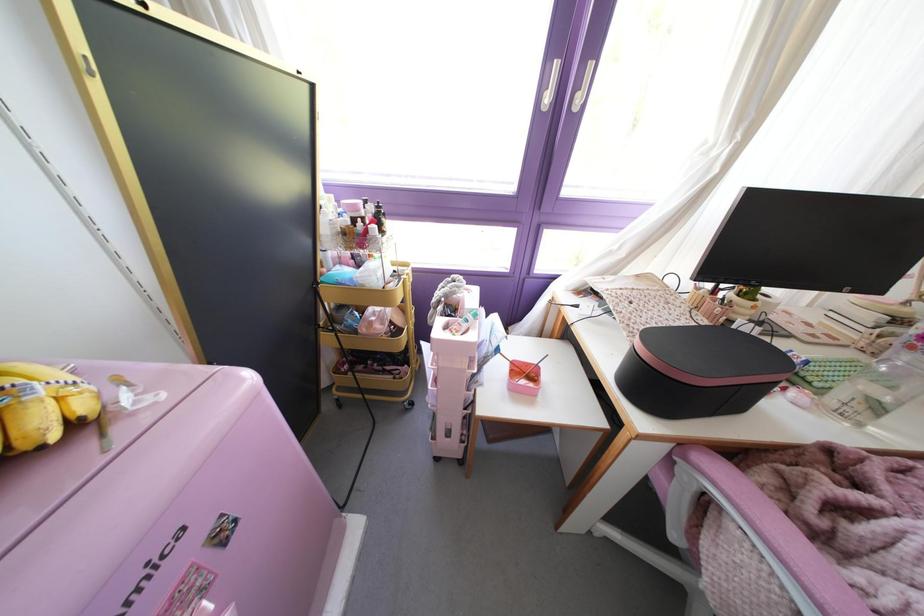
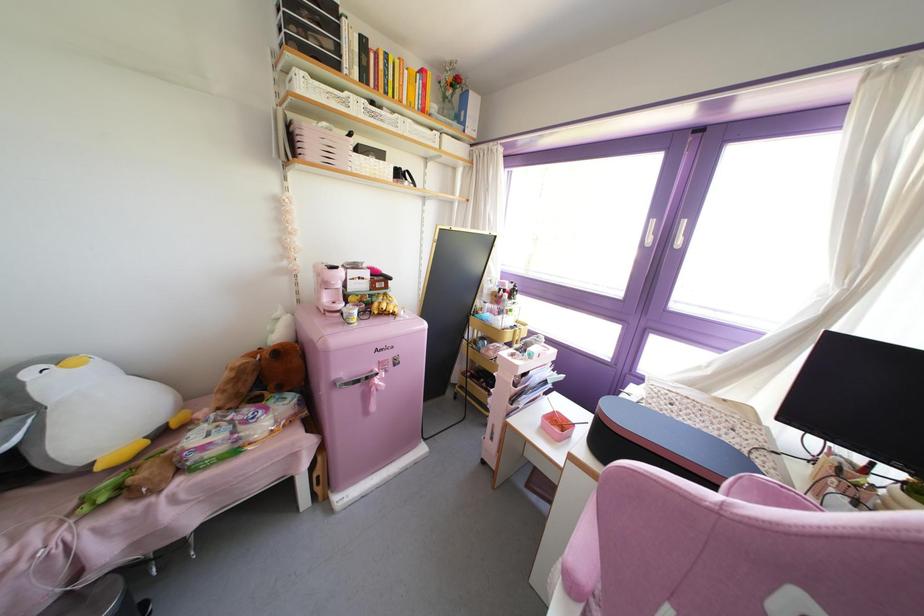
The point at (439, 307) is marked in the first image. Where is the corresponding point in the second image?

(516, 345)